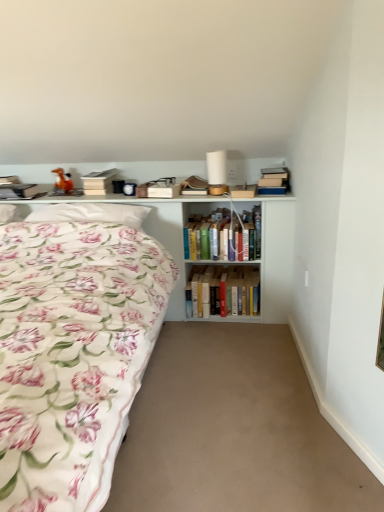
Question: Does beige carpet at center have a smaller size compared to orange matte toy horse at upper left?

Choices:
 (A) no
 (B) yes

Answer: (A)

Question: Is beige carpet at center at the left side of orange matte toy horse at upper left?

Choices:
 (A) yes
 (B) no

Answer: (B)

Question: Can you confirm if beige carpet at center is taller than orange matte toy horse at upper left?

Choices:
 (A) yes
 (B) no

Answer: (B)

Question: Is beige carpet at center positioned behind orange matte toy horse at upper left?

Choices:
 (A) yes
 (B) no

Answer: (B)

Question: Can orange matte toy horse at upper left be found inside beige carpet at center?

Choices:
 (A) yes
 (B) no

Answer: (B)

Question: Is white wooden shelf at upper left taller or shorter than hardcover book at upper center, which is the 1th paperback book from right to left?

Choices:
 (A) short
 (B) tall

Answer: (B)

Question: From a real-world perspective, is white wooden shelf at upper left physically located above or below hardcover book at upper center, which is the 1th paperback book from right to left?

Choices:
 (A) below
 (B) above

Answer: (A)

Question: Is point (168, 248) positioned closer to the camera than point (243, 189)?

Choices:
 (A) farther
 (B) closer

Answer: (B)

Question: Is white wooden shelf at upper left to the left or to the right of hardcover book at upper center, which is the 3th paperback book in left-to-right order, in the image?

Choices:
 (A) left
 (B) right

Answer: (A)

Question: Based on their sizes in the image, would you say beige carpet at center is bigger or smaller than hardcover book at upper right, marked as the 3th book in a bottom-to-top arrangement?

Choices:
 (A) big
 (B) small

Answer: (A)

Question: Is point (208, 344) closer or farther from the camera than point (266, 181)?

Choices:
 (A) closer
 (B) farther

Answer: (A)

Question: Considering the positions of beige carpet at center and hardcover book at upper right, marked as the 3th book in a bottom-to-top arrangement, in the image, is beige carpet at center wider or thinner than hardcover book at upper right, marked as the 3th book in a bottom-to-top arrangement,?

Choices:
 (A) thin
 (B) wide

Answer: (B)

Question: From a real-world perspective, is beige carpet at center physically located above or below hardcover book at upper right, marked as the 3th book in a bottom-to-top arrangement?

Choices:
 (A) above
 (B) below

Answer: (B)

Question: From a real-world perspective, relative to matte brown paperback book at upper center, which is counted as the second paperback book, starting from the right, is white soft pillow at upper left vertically above or below?

Choices:
 (A) above
 (B) below

Answer: (B)

Question: From their relative heights in the image, would you say white soft pillow at upper left is taller or shorter than matte brown paperback book at upper center, which is counted as the second paperback book, starting from the right?

Choices:
 (A) short
 (B) tall

Answer: (B)